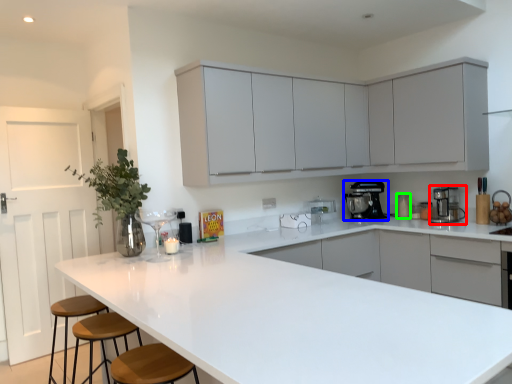
Question: Estimate the real-world distances between objects in this image. Which object is farther from home appliance (highlighted by a red box), home appliance (highlighted by a blue box) or appliance (highlighted by a green box)?

Choices:
 (A) home appliance
 (B) appliance

Answer: (A)